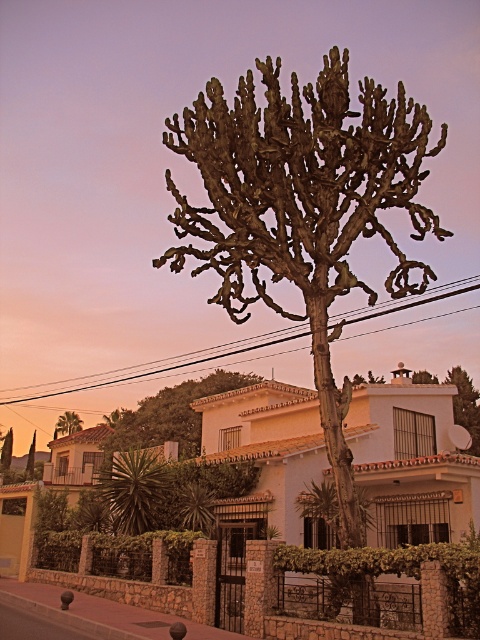
Between green leafy tree at upper left and brown textured cactus at center, which one appears on the right side from the viewer's perspective?

From the viewer's perspective, green leafy tree at upper left appears more on the right side.

From the picture: Is green leafy tree at upper left positioned behind brown textured cactus at center?

Yes, it is behind brown textured cactus at center.

Locate an element on the screen. This screenshot has height=640, width=480. green leafy tree at upper left is located at coordinates (68, 422).

Which is behind, point (195, 444) or point (0, 464)?

Point (0, 464)

Is green leafy tree at center positioned behind brown textured cactus at center?

No, it is in front of brown textured cactus at center.

This screenshot has width=480, height=640. What do you see at coordinates (170, 416) in the screenshot? I see `green leafy tree at center` at bounding box center [170, 416].

I want to click on green leafy tree at center, so click(170, 416).

What do you see at coordinates (302, 209) in the screenshot? I see `green spiky cactus at center` at bounding box center [302, 209].

Is point (245, 145) positioned in front of point (80, 422)?

That is True.

Identify the location of green spiky cactus at center. This screenshot has width=480, height=640. (302, 209).